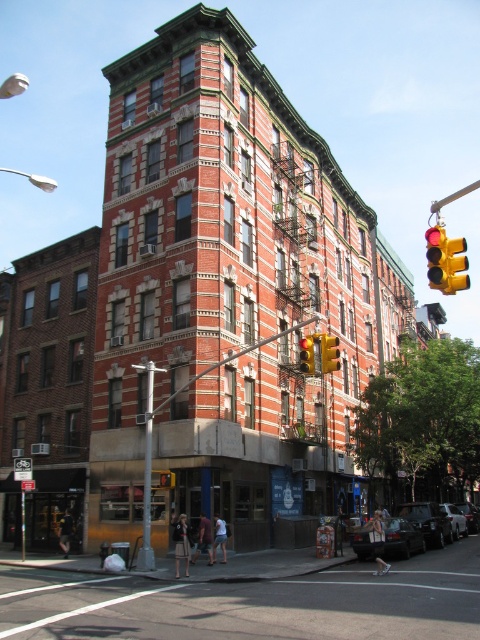
Is the position of yellow metallic traffic light at upper right more distant than that of yellow plastic traffic light at upper right?

That is False.

This screenshot has height=640, width=480. Identify the location of yellow metallic traffic light at upper right. (445, 260).

Between point (431, 232) and point (326, 333), which one is positioned behind?

The point (326, 333) is more distant.

The height and width of the screenshot is (640, 480). Identify the location of yellow metallic traffic light at upper right. (445, 260).

Can you confirm if yellow plastic traffic light at center is positioned below yellow matte traffic light at upper right?

Incorrect, yellow plastic traffic light at center is not positioned below yellow matte traffic light at upper right.

Find the location of `yellow plastic traffic light at center`. yellow plastic traffic light at center is located at coordinates (307, 355).

The height and width of the screenshot is (640, 480). In order to click on yellow plastic traffic light at center in this screenshot , I will do pyautogui.click(x=307, y=355).

From the picture: Is yellow metallic traffic light at upper right smaller than yellow matte traffic light at upper right?

Incorrect, yellow metallic traffic light at upper right is not smaller in size than yellow matte traffic light at upper right.

Can you confirm if yellow metallic traffic light at upper right is positioned below yellow matte traffic light at upper right?

Incorrect, yellow metallic traffic light at upper right is not positioned below yellow matte traffic light at upper right.

In the scene shown: Measure the distance between point [446,275] and camera.

The distance of point [446,275] from camera is 26.34 meters.

Where is `yellow metallic traffic light at upper right`? yellow metallic traffic light at upper right is located at coordinates (445, 260).